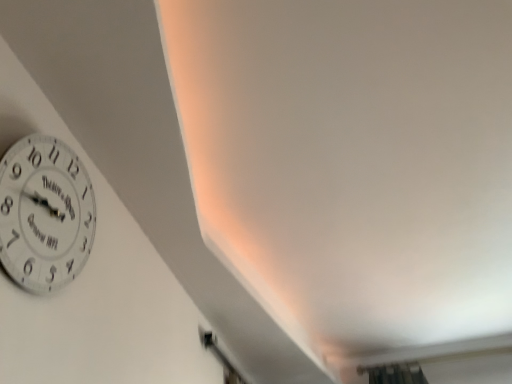
What is the approximate width of white paper clock at upper left?

The width of white paper clock at upper left is 4.63 centimeters.

What do you see at coordinates (45, 214) in the screenshot?
I see `white paper clock at upper left` at bounding box center [45, 214].

Identify the location of white paper clock at upper left. This screenshot has width=512, height=384. (45, 214).

Where is `white paper clock at upper left`? The width and height of the screenshot is (512, 384). white paper clock at upper left is located at coordinates (45, 214).